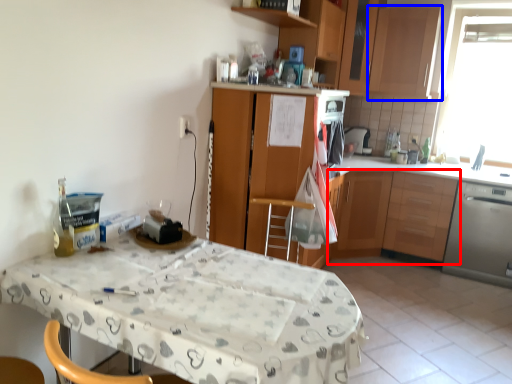
Question: Which object appears farthest to the camera in this image, cabinetry (highlighted by a red box) or cabinetry (highlighted by a blue box)?

Choices:
 (A) cabinetry
 (B) cabinetry

Answer: (B)